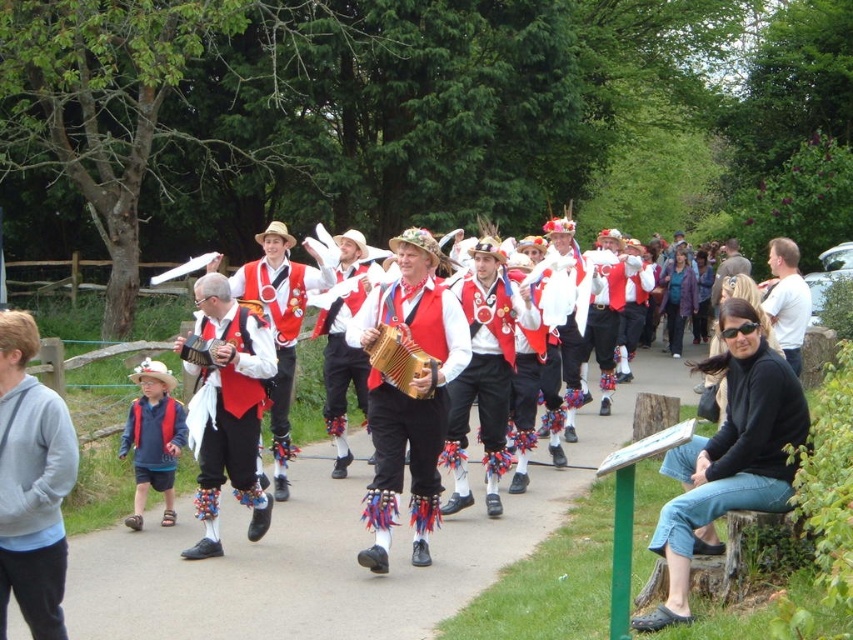
You are a photographer standing at the center of the paved path. You want to capture a photo that includes both the black matte jacket at lower right and the gray fleece sweatshirt at left. Given that your camera has a maximum horizontal field of view of 2 meters, will you be able to fit both items in the same frame without moving?

The distance between the black matte jacket at lower right and the gray fleece sweatshirt at left is 2.58 meters. Since the camera can only capture up to 2 meters horizontally, the photographer cannot fit both items in the same frame without moving closer or adjusting the angle.

Consider the image. You are a photographer standing on the path, trying to capture a photo of the blue denim shorts at left and the matte wooden accordion at center. Which object should you focus on first if you want to include both in your shot?

The blue denim shorts at left is located below the matte wooden accordion at center, so you should focus on the matte wooden accordion at center first to ensure both are in frame.

You are organizing a parade and need to ensure that the blue denim shorts at left and the matte wooden accordion at center can fit side by side on a 1.2 meter wide stage. Based on their widths, will they both fit?

The blue denim shorts at left is wider than the matte wooden accordion at center. Since the total width of both items combined exceeds 1.2 meters, they cannot fit side by side on the stage.